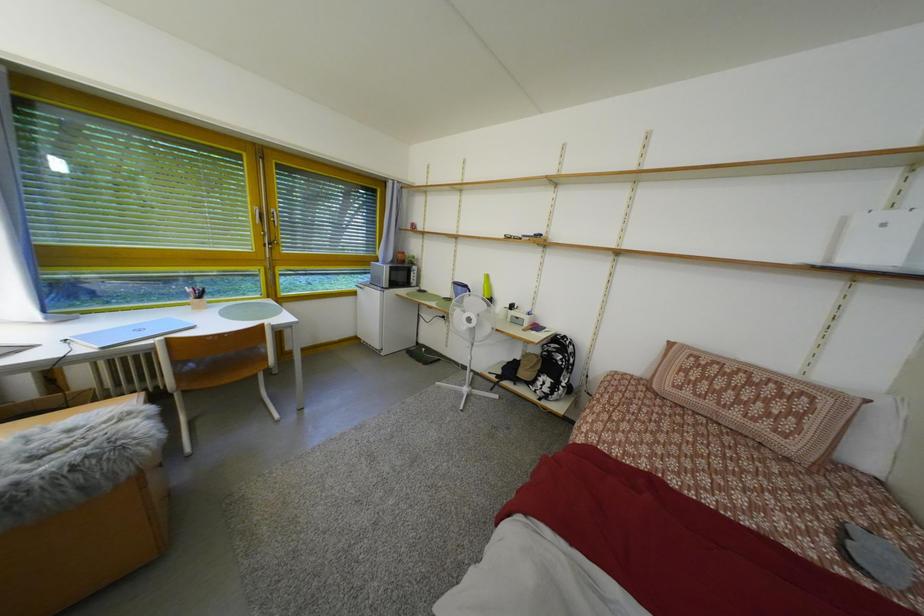
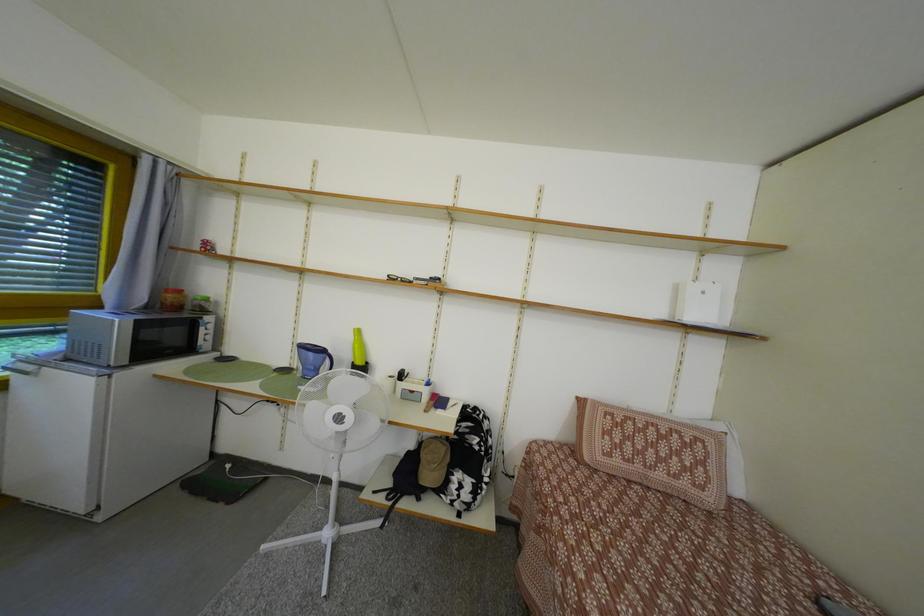
Question: How did the camera likely rotate?

Choices:
 (A) Left
 (B) Right
 (C) Up
 (D) Down

Answer: (B)